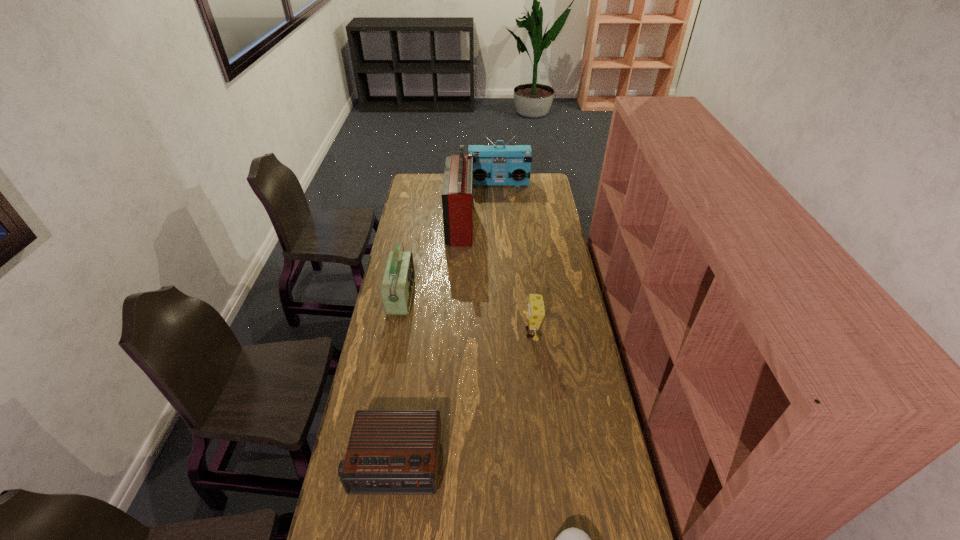
Locate an element on the screen. free spot that satisfies the following two spatial constraints: 1. on the face of the sponge; 2. on the front panel of the nearest radio receiver is located at coordinates (545, 462).

The image size is (960, 540). What are the coordinates of `vacant region that satisfies the following two spatial constraints: 1. on the front-facing side of the farthest object; 2. on the front-facing side of the fifth nearest object` in the screenshot? It's located at (501, 223).

Find the location of `vacant space that satisfies the following two spatial constraints: 1. on the front-facing side of the farthest object; 2. on the front-facing side of the third nearest radio receiver`. vacant space that satisfies the following two spatial constraints: 1. on the front-facing side of the farthest object; 2. on the front-facing side of the third nearest radio receiver is located at coordinates (501, 223).